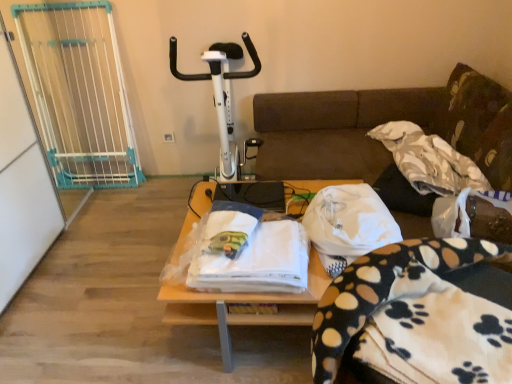
In order to face white plastic exercise bike at center, should I rotate leftwards or rightwards?

You should rotate left by 4.158 degrees.

Image resolution: width=512 pixels, height=384 pixels. What do you see at coordinates (429, 160) in the screenshot?
I see `white textured blanket at upper right, which appears as the 1th blanket when viewed from the back` at bounding box center [429, 160].

What do you see at coordinates (249, 253) in the screenshot? I see `white fleece blanket at center, the third blanket in the right-to-left sequence` at bounding box center [249, 253].

Identify the location of white fabric at center. This screenshot has width=512, height=384. (349, 221).

Where is `white plastic exercise bike at center`? Image resolution: width=512 pixels, height=384 pixels. white plastic exercise bike at center is located at coordinates (220, 97).

From a real-world perspective, is wooden table at center positioned over fluffy green pillow at upper right based on gravity?

Incorrect, from a real-world perspective, wooden table at center is lower than fluffy green pillow at upper right.

From the image's perspective, does wooden table at center appear lower than fluffy green pillow at upper right?

Yes, from the image's perspective, wooden table at center is below fluffy green pillow at upper right.

Between wooden table at center and fluffy green pillow at upper right, which one has larger size?

wooden table at center is bigger.

From a real-world perspective, which is physically below, white fabric at center or wooden table at center?

wooden table at center is physically lower.

Considering the relative sizes of white fabric at center and wooden table at center in the image provided, is white fabric at center smaller than wooden table at center?

Correct, white fabric at center occupies less space than wooden table at center.

In order to click on table beneath the white fabric at center (from a real-world perspective) in this screenshot , I will do `click(243, 303)`.

Based on the photo, considering their positions, is white fabric at center located in front of or behind wooden table at center?

Clearly, white fabric at center is in front of wooden table at center.

From a real-world perspective, which object stands above the other?

From a 3D spatial view, white fabric at center is above.

From the picture: Who is taller, white fleece blanket at center, which is the first blanket from left to right, or white fabric at center?

white fabric at center.

Would you say white fleece blanket at center, acting as the 2th blanket starting from the back, is to the left or to the right of white fabric at center in the picture?

From the image, it's evident that white fleece blanket at center, acting as the 2th blanket starting from the back, is to the left of white fabric at center.

Identify the location of the 1st blanket below the white fabric at center (from the image's perspective). (249, 253).

The width and height of the screenshot is (512, 384). I want to click on sport equipment above the white fabric at center (from the image's perspective), so click(x=220, y=97).

Based on the photo, considering the relative positions of white plastic exercise bike at center and white fabric at center in the image provided, is white plastic exercise bike at center in front of white fabric at center?

No, white plastic exercise bike at center is further to the viewer.

Do you think white plastic exercise bike at center is within white fabric at center, or outside of it?

white plastic exercise bike at center is not enclosed by white fabric at center.

Between white fleece blanket with paw prints at lower right, the 2th blanket from the left, and white plastic exercise bike at center, which one has larger size?

white plastic exercise bike at center.

Does white fleece blanket with paw prints at lower right, the 2th blanket from the left, have a greater width compared to white plastic exercise bike at center?

In fact, white fleece blanket with paw prints at lower right, the 2th blanket from the left, might be narrower than white plastic exercise bike at center.

From the picture: Is white fleece blanket with paw prints at lower right, acting as the 1th blanket starting from the front, looking in the opposite direction of white plastic exercise bike at center?

No.

From the image's perspective, is white fleece blanket with paw prints at lower right, acting as the 3th blanket starting from the back, under white plastic exercise bike at center?

Yes, from the image's perspective, white fleece blanket with paw prints at lower right, acting as the 3th blanket starting from the back, is below white plastic exercise bike at center.

Between wooden table at center and white fleece blanket at center, the third blanket in the right-to-left sequence, which one appears on the right side from the viewer's perspective?

wooden table at center.

Are wooden table at center and white fleece blanket at center, acting as the 2th blanket starting from the back, far apart?

wooden table at center is actually quite close to white fleece blanket at center, acting as the 2th blanket starting from the back.

Does wooden table at center turn towards white fleece blanket at center, acting as the 2th blanket starting from the back?

No, wooden table at center is not aimed at white fleece blanket at center, acting as the 2th blanket starting from the back.

Which of these two, wooden table at center or white fleece blanket at center, which ranks as the second blanket in front-to-back order, is thinner?

white fleece blanket at center, which ranks as the second blanket in front-to-back order, is thinner.

From the image's perspective, which one is positioned higher, white plastic exercise bike at center or wooden table at center?

white plastic exercise bike at center, from the image's perspective.

Is white plastic exercise bike at center not inside wooden table at center?

Absolutely, white plastic exercise bike at center is external to wooden table at center.

You are a GUI agent. You are given a task and a screenshot of the screen. Output one action in this format:
    pyautogui.click(x=<x>, y=<y>)
    Task: Click on the sport equipment above the wooden table at center (from the image's perspective)
    
    Given the screenshot: What is the action you would take?
    pyautogui.click(x=220, y=97)

Is point (209, 75) farther from viewer compared to point (196, 300)?

Yes, it is behind point (196, 300).

Locate an element on the screen. The height and width of the screenshot is (384, 512). pillow lying behind the wooden table at center is located at coordinates (478, 123).

Identify the location of table that is on the left side of white fabric at center. Image resolution: width=512 pixels, height=384 pixels. (243, 303).

Considering their positions, is white textured blanket at upper right, which appears as the 1th blanket when viewed from the back, positioned closer to white fleece blanket at center, acting as the 2th blanket starting from the back, than white fleece blanket with paw prints at lower right, acting as the 1th blanket starting from the front?

Based on the image, white textured blanket at upper right, which appears as the 1th blanket when viewed from the back, appears to be nearer to white fleece blanket at center, acting as the 2th blanket starting from the back.

In the scene shown: From the image, which object appears to be nearer to white plastic exercise bike at center, white textured blanket at upper right, which is the 3th blanket in left-to-right order, or wooden table at center?

Based on the image, wooden table at center appears to be nearer to white plastic exercise bike at center.

Considering their positions, is wooden table at center positioned closer to white plastic exercise bike at center than white fleece blanket with paw prints at lower right, acting as the 1th blanket starting from the front?

wooden table at center is positioned closer to the anchor white plastic exercise bike at center.

Looking at the image, which one is located closer to white textured blanket at upper right, which appears as the 1th blanket when viewed from the back, wooden table at center or white fleece blanket with paw prints at lower right, the 2th blanket from the left?

wooden table at center lies closer to white textured blanket at upper right, which appears as the 1th blanket when viewed from the back, than the other object.

From the image, which object appears to be nearer to white fleece blanket with paw prints at lower right, acting as the 3th blanket starting from the back, white fabric at center or white fleece blanket at center, the third blanket in the right-to-left sequence?

white fleece blanket at center, the third blanket in the right-to-left sequence, is positioned closer to the anchor white fleece blanket with paw prints at lower right, acting as the 3th blanket starting from the back.

Which object lies nearer to the anchor point wooden table at center, fluffy green pillow at upper right or white fleece blanket with paw prints at lower right, positioned as the second blanket in right-to-left order?

Among the two, white fleece blanket with paw prints at lower right, positioned as the second blanket in right-to-left order, is located nearer to wooden table at center.

Estimate the real-world distances between objects in this image. Which object is closer to fluffy green pillow at upper right, white fabric at center or wooden table at center?

The object closer to fluffy green pillow at upper right is white fabric at center.

From the image, which object appears to be nearer to white fleece blanket at center, which is the first blanket from left to right, wooden table at center or white plastic exercise bike at center?

wooden table at center.

Identify the location of cloth between wooden table at center and white textured blanket at upper right, placed as the third blanket when sorted from front to back. The width and height of the screenshot is (512, 384). (349, 221).

I want to click on cloth between white fleece blanket at center, which ranks as the second blanket in front-to-back order, and white textured blanket at upper right, which is the 3th blanket in left-to-right order, so click(x=349, y=221).

Find the location of `cloth between white fleece blanket at center, which ranks as the second blanket in front-to-back order, and fluffy green pillow at upper right from left to right`. cloth between white fleece blanket at center, which ranks as the second blanket in front-to-back order, and fluffy green pillow at upper right from left to right is located at coordinates (x=349, y=221).

The width and height of the screenshot is (512, 384). Find the location of `cloth that lies between white plastic exercise bike at center and white fleece blanket at center, the third blanket in the right-to-left sequence, from top to bottom`. cloth that lies between white plastic exercise bike at center and white fleece blanket at center, the third blanket in the right-to-left sequence, from top to bottom is located at coordinates (349, 221).